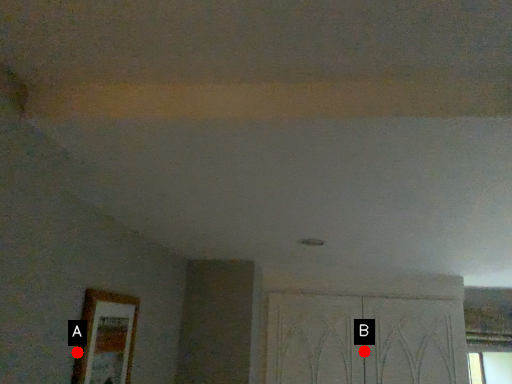
Question: Two points are circled on the image, labeled by A and B beside each circle. Which of the following is the farthest from the observer?

Choices:
 (A) A is further
 (B) B is further

Answer: (B)